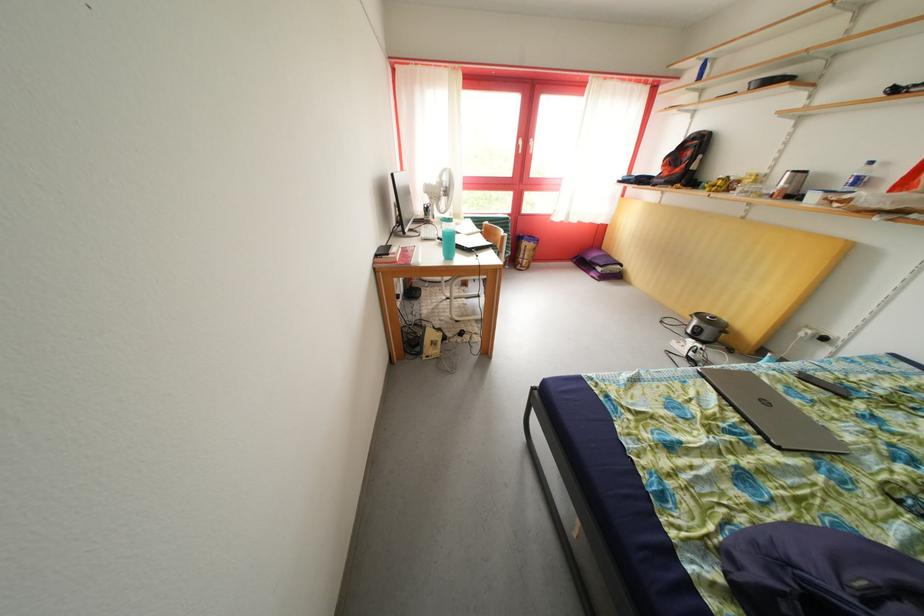
Where would you lift the plastic water bottle? Please return your answer as a coordinate pair (x, y).

(859, 176)